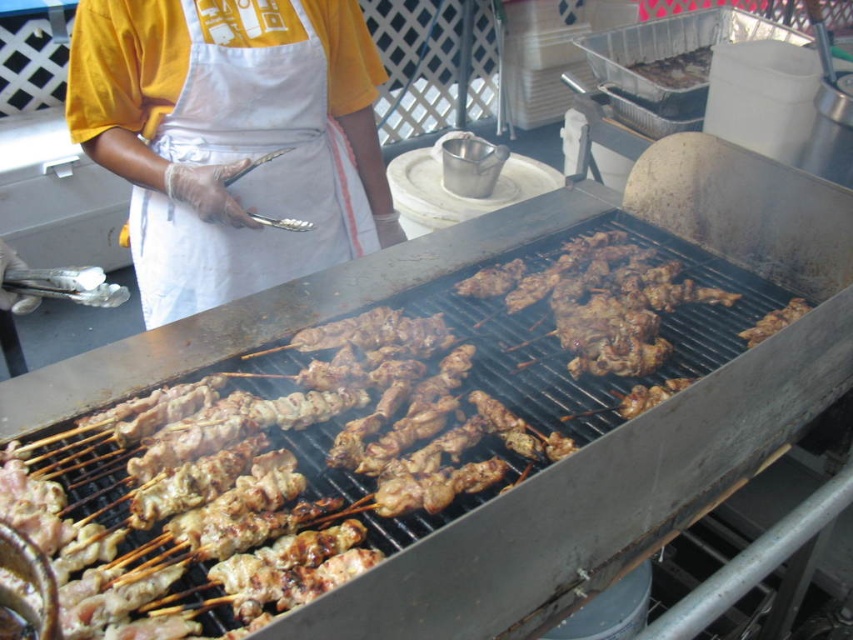
You are a photographer trying to capture the perfect shot of the grill. You notice two points on the grill, one at coordinate point (572, 380) and the other at point (688, 65). Which point should you focus on to ensure it appears larger in your photo?

Point (572, 380) is closer to the camera than point (688, 65), so focusing on point (572, 380) will make it appear larger in the photo.

You are standing in front of the grill and want to place a new skewer at one of the two points mentioned. Which point is closer to you, point (401, 435) or point (310, 198)?

Point (401, 435) is closer to the viewer than point (310, 198), so you should place the skewer there if you want it nearer to your position.

You are standing in front of the grill at the street food stall. There is a specific point marked at coordinates point (x=674, y=74). If you want to reach this point without moving your feet, can you comfortably do so?

The point (x=674, y=74) is 2.87 meters away from the viewer. Since this distance is quite far, you would not be able to comfortably reach it without moving your feet.